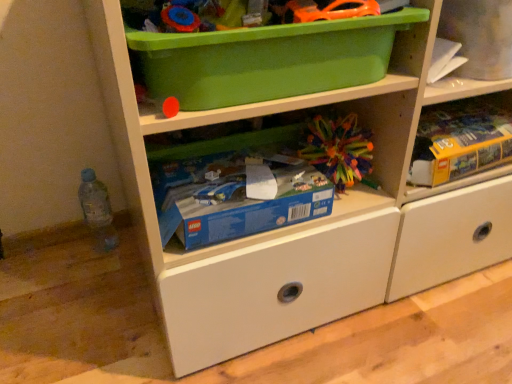
Find the location of a particular element. yellow cardboard box at upper right is located at coordinates (461, 146).

Locate an element on the screen. green plastic storage box at upper center, arranged as the 2th storage box when ordered from the bottom is located at coordinates (267, 59).

The height and width of the screenshot is (384, 512). Describe the element at coordinates (237, 196) in the screenshot. I see `blue cardboard lego box at center, the first storage box when ordered from bottom to top` at that location.

Locate an element on the screen. The image size is (512, 384). multicolored plastic ball at center, the first toy positioned from the bottom is located at coordinates (338, 149).

At what (x,y) coordinates should I click in order to perform the action: click on orange plastic toy car at upper center, arranged as the 1th toy when viewed from the top. Please return your answer as a coordinate pair (x, y). The image size is (512, 384). Looking at the image, I should click on (327, 10).

Locate an element on the screen. yellow cardboard box at upper right is located at coordinates (461, 146).

Considering the sizes of objects blue cardboard lego box at center, acting as the second storage box starting from the top, and green plastic storage box at upper center, marked as the 1th storage box in a top-to-bottom arrangement, in the image provided, who is thinner, blue cardboard lego box at center, acting as the second storage box starting from the top, or green plastic storage box at upper center, marked as the 1th storage box in a top-to-bottom arrangement,?

Thinner between the two is blue cardboard lego box at center, acting as the second storage box starting from the top.

From the picture: Which object is closer to the camera, blue cardboard lego box at center, acting as the second storage box starting from the top, or green plastic storage box at upper center, marked as the 1th storage box in a top-to-bottom arrangement?

green plastic storage box at upper center, marked as the 1th storage box in a top-to-bottom arrangement, is in front.

From the picture: Is blue cardboard lego box at center, the first storage box when ordered from bottom to top, to the right of green plastic storage box at upper center, marked as the 1th storage box in a top-to-bottom arrangement, from the viewer's perspective?

Incorrect, blue cardboard lego box at center, the first storage box when ordered from bottom to top, is not on the right side of green plastic storage box at upper center, marked as the 1th storage box in a top-to-bottom arrangement.

Is blue cardboard lego box at center, acting as the second storage box starting from the top, completely or partially outside of green plastic storage box at upper center, marked as the 1th storage box in a top-to-bottom arrangement?

blue cardboard lego box at center, acting as the second storage box starting from the top, lies outside green plastic storage box at upper center, marked as the 1th storage box in a top-to-bottom arrangement,'s area.

Considering the sizes of objects blue cardboard lego box at center, acting as the second storage box starting from the top, and orange plastic toy car at upper center, the 2th toy from the bottom, in the image provided, who is thinner, blue cardboard lego box at center, acting as the second storage box starting from the top, or orange plastic toy car at upper center, the 2th toy from the bottom,?

orange plastic toy car at upper center, the 2th toy from the bottom, is thinner.

The height and width of the screenshot is (384, 512). Identify the location of the 2nd storage box below the orange plastic toy car at upper center, the first toy viewed from the front (from the image's perspective). (237, 196).

Who is shorter, blue cardboard lego box at center, acting as the second storage box starting from the top, or orange plastic toy car at upper center, the first toy viewed from the front?

orange plastic toy car at upper center, the first toy viewed from the front, is shorter.

Is blue cardboard lego box at center, the first storage box when ordered from bottom to top, at the right side of orange plastic toy car at upper center, which appears as the second toy when viewed from the back?

No.

From the picture: From the image's perspective, which one is positioned lower, orange plastic toy car at upper center, arranged as the 1th toy when viewed from the top, or green plastic storage box at upper center, arranged as the 2th storage box when ordered from the bottom?

green plastic storage box at upper center, arranged as the 2th storage box when ordered from the bottom.

Is orange plastic toy car at upper center, which appears as the second toy when viewed from the back, positioned with its back to green plastic storage box at upper center, arranged as the 2th storage box when ordered from the bottom?

That's right, orange plastic toy car at upper center, which appears as the second toy when viewed from the back, is facing away from green plastic storage box at upper center, arranged as the 2th storage box when ordered from the bottom.

How much distance is there between orange plastic toy car at upper center, the first toy viewed from the front, and green plastic storage box at upper center, arranged as the 2th storage box when ordered from the bottom?

orange plastic toy car at upper center, the first toy viewed from the front, is 8.20 centimeters from green plastic storage box at upper center, arranged as the 2th storage box when ordered from the bottom.

Looking at this image, is orange plastic toy car at upper center, the 2th toy from the bottom, at the right side of green plastic storage box at upper center, marked as the 1th storage box in a top-to-bottom arrangement?

Yes.

Based on the photo, can you confirm if yellow cardboard box at upper right is bigger than blue cardboard lego box at center, the first storage box when ordered from bottom to top?

No.

Which is closer to the camera, (x=492, y=106) or (x=307, y=180)?

Point (x=492, y=106).

Is yellow cardboard box at upper right aimed at blue cardboard lego box at center, the first storage box when ordered from bottom to top?

No, yellow cardboard box at upper right is not aimed at blue cardboard lego box at center, the first storage box when ordered from bottom to top.

From a real-world perspective, which object rests below the other?

In real-world perspective, blue cardboard lego box at center, the first storage box when ordered from bottom to top, is lower.

Are translucent plastic bottle at lower left and multicolored plastic ball at center, marked as the 2th toy in a top-to-bottom arrangement, located far from each other?

Actually, translucent plastic bottle at lower left and multicolored plastic ball at center, marked as the 2th toy in a top-to-bottom arrangement, are a little close together.

Is multicolored plastic ball at center, the first toy positioned from the bottom, at the back of translucent plastic bottle at lower left?

translucent plastic bottle at lower left is not turned away from multicolored plastic ball at center, the first toy positioned from the bottom.

Considering the relative sizes of translucent plastic bottle at lower left and multicolored plastic ball at center, the first toy positioned from the bottom, in the image provided, is translucent plastic bottle at lower left smaller than multicolored plastic ball at center, the first toy positioned from the bottom,?

Indeed, translucent plastic bottle at lower left has a smaller size compared to multicolored plastic ball at center, the first toy positioned from the bottom.

In the image, is translucent plastic bottle at lower left on the left side or the right side of multicolored plastic ball at center, which is the first toy in back-to-front order?

translucent plastic bottle at lower left is positioned on multicolored plastic ball at center, which is the first toy in back-to-front order,'s left side.

Who is bigger, translucent plastic bottle at lower left or yellow cardboard box at upper right?

yellow cardboard box at upper right.

Based on the photo, is translucent plastic bottle at lower left situated inside yellow cardboard box at upper right or outside?

translucent plastic bottle at lower left cannot be found inside yellow cardboard box at upper right.

Is point (108, 216) closer or farther from the camera than point (441, 144)?

Clearly, point (108, 216) is more distant from the camera than point (441, 144).

How much distance is there between translucent plastic bottle at lower left and yellow cardboard box at upper right?

The distance of translucent plastic bottle at lower left from yellow cardboard box at upper right is 30.98 inches.

Is translucent plastic bottle at lower left with green plastic storage box at upper center, arranged as the 2th storage box when ordered from the bottom?

No, translucent plastic bottle at lower left is not touching green plastic storage box at upper center, arranged as the 2th storage box when ordered from the bottom.

Is translucent plastic bottle at lower left bigger or smaller than green plastic storage box at upper center, marked as the 1th storage box in a top-to-bottom arrangement?

Clearly, translucent plastic bottle at lower left is smaller in size than green plastic storage box at upper center, marked as the 1th storage box in a top-to-bottom arrangement.

You are a GUI agent. You are given a task and a screenshot of the screen. Output one action in this format:
    pyautogui.click(x=<x>, y=<y>)
    Task: Click on the bottle on the left side of green plastic storage box at upper center, marked as the 1th storage box in a top-to-bottom arrangement
    This screenshot has height=384, width=512.
    Given the screenshot: What is the action you would take?
    [97, 210]

Considering their positions, is translucent plastic bottle at lower left located in front of or behind green plastic storage box at upper center, arranged as the 2th storage box when ordered from the bottom?

In the image, translucent plastic bottle at lower left appears behind green plastic storage box at upper center, arranged as the 2th storage box when ordered from the bottom.

Find the location of `storage box above the blue cardboard lego box at center, acting as the second storage box starting from the top (from the image's perspective)`. storage box above the blue cardboard lego box at center, acting as the second storage box starting from the top (from the image's perspective) is located at coordinates (267, 59).

You are a GUI agent. You are given a task and a screenshot of the screen. Output one action in this format:
    pyautogui.click(x=<x>, y=<y>)
    Task: Click on the storage box behind the orange plastic toy car at upper center, the 2th toy from the bottom
    This screenshot has height=384, width=512.
    Given the screenshot: What is the action you would take?
    pyautogui.click(x=237, y=196)

From the image, which object appears to be nearer to blue cardboard lego box at center, acting as the second storage box starting from the top, green plastic storage box at upper center, marked as the 1th storage box in a top-to-bottom arrangement, or translucent plastic bottle at lower left?

green plastic storage box at upper center, marked as the 1th storage box in a top-to-bottom arrangement.

Looking at the image, which one is located closer to yellow cardboard box at upper right, blue cardboard lego box at center, acting as the second storage box starting from the top, or multicolored plastic ball at center, the first toy positioned from the bottom?

multicolored plastic ball at center, the first toy positioned from the bottom, lies closer to yellow cardboard box at upper right than the other object.

Considering their positions, is multicolored plastic ball at center, marked as the 2th toy in a top-to-bottom arrangement, positioned closer to orange plastic toy car at upper center, which appears as the second toy when viewed from the back, than translucent plastic bottle at lower left?

Based on the image, multicolored plastic ball at center, marked as the 2th toy in a top-to-bottom arrangement, appears to be nearer to orange plastic toy car at upper center, which appears as the second toy when viewed from the back.

Which object lies further to the anchor point translucent plastic bottle at lower left, multicolored plastic ball at center, the 2th toy when ordered from front to back, or blue cardboard lego box at center, acting as the second storage box starting from the top?

Among the two, multicolored plastic ball at center, the 2th toy when ordered from front to back, is located further to translucent plastic bottle at lower left.

Looking at this image, looking at the image, which one is located closer to green plastic storage box at upper center, marked as the 1th storage box in a top-to-bottom arrangement, orange plastic toy car at upper center, which appears as the second toy when viewed from the back, or yellow cardboard box at upper right?

Among the two, orange plastic toy car at upper center, which appears as the second toy when viewed from the back, is located nearer to green plastic storage box at upper center, marked as the 1th storage box in a top-to-bottom arrangement.

In the scene shown: Based on their spatial positions, is translucent plastic bottle at lower left or blue cardboard lego box at center, the first storage box when ordered from bottom to top, further from green plastic storage box at upper center, marked as the 1th storage box in a top-to-bottom arrangement?

translucent plastic bottle at lower left is further to green plastic storage box at upper center, marked as the 1th storage box in a top-to-bottom arrangement.

Based on their spatial positions, is translucent plastic bottle at lower left or yellow cardboard box at upper right further from orange plastic toy car at upper center, the 2th toy from the bottom?

translucent plastic bottle at lower left is further to orange plastic toy car at upper center, the 2th toy from the bottom.

Based on the photo, based on their spatial positions, is orange plastic toy car at upper center, the first toy viewed from the front, or yellow cardboard box at upper right further from blue cardboard lego box at center, the first storage box when ordered from bottom to top?

yellow cardboard box at upper right lies further to blue cardboard lego box at center, the first storage box when ordered from bottom to top, than the other object.

Where is `toy located between orange plastic toy car at upper center, the first toy viewed from the front, and yellow cardboard box at upper right in the left-right direction`? toy located between orange plastic toy car at upper center, the first toy viewed from the front, and yellow cardboard box at upper right in the left-right direction is located at coordinates (338, 149).

Where is `toy between orange plastic toy car at upper center, arranged as the 1th toy when viewed from the top, and blue cardboard lego box at center, acting as the second storage box starting from the top, vertically`? toy between orange plastic toy car at upper center, arranged as the 1th toy when viewed from the top, and blue cardboard lego box at center, acting as the second storage box starting from the top, vertically is located at coordinates (338, 149).

Identify the location of toy between translucent plastic bottle at lower left and multicolored plastic ball at center, marked as the 2th toy in a top-to-bottom arrangement. The image size is (512, 384). (327, 10).

Locate an element on the screen. The width and height of the screenshot is (512, 384). storage box between blue cardboard lego box at center, the first storage box when ordered from bottom to top, and yellow cardboard box at upper right is located at coordinates (267, 59).